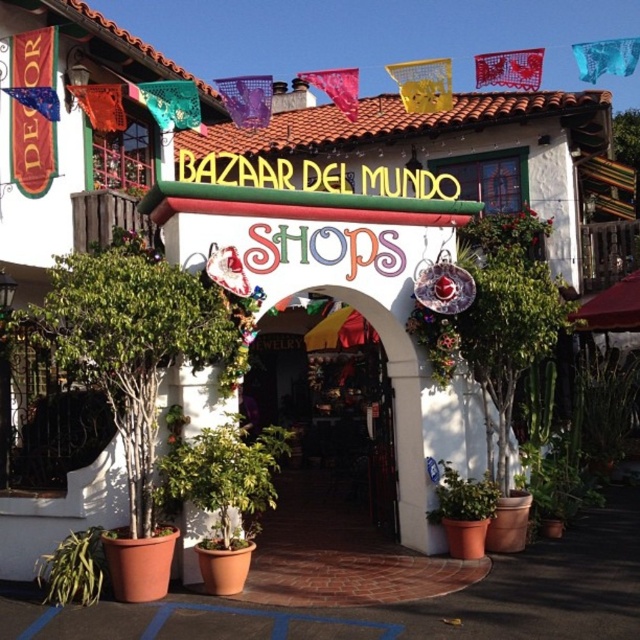
Between wooden door at center and green matte plant at lower right, which one is positioned higher?

wooden door at center is higher up.

Is wooden door at center thinner than green matte plant at lower right?

No.

Locate an element on the screen. wooden door at center is located at coordinates (330, 403).

Identify the location of wooden door at center. The height and width of the screenshot is (640, 640). (330, 403).

Is point (244, 499) positioned in front of point (579, 452)?

That is True.

Can you confirm if green leafy plant at center is smaller than green matte plant at lower right?

Yes.

Which is in front, point (225, 490) or point (516, 436)?

Point (225, 490) is more forward.

This screenshot has width=640, height=640. I want to click on green leafy plant at center, so click(225, 477).

Can you confirm if wooden door at center is positioned below green matte plant at lower left?

Actually, wooden door at center is above green matte plant at lower left.

Which is more to the left, wooden door at center or green matte plant at lower left?

Positioned to the left is green matte plant at lower left.

Is point (348, 376) behind point (96, 577)?

Yes, point (348, 376) is behind point (96, 577).

Locate an element on the screen. The height and width of the screenshot is (640, 640). wooden door at center is located at coordinates (330, 403).